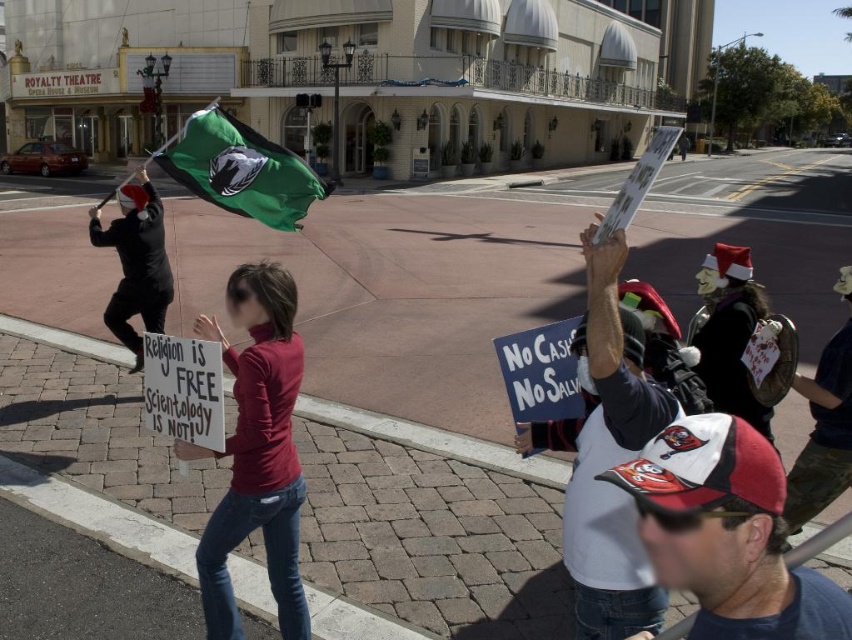
Which is more to the left, green fabric flag at upper left or santa hat at upper right?

Positioned to the left is green fabric flag at upper left.

Locate an element on the screen. green fabric flag at upper left is located at coordinates (240, 170).

Who is taller, white fabric cap at center or green fabric flag at upper left?

With more height is green fabric flag at upper left.

Who is more distant from viewer, (761,449) or (204,177)?

The point (204,177) is behind.

Is point (622, 470) behind point (279, 161)?

No, (622, 470) is in front of (279, 161).

Where is `white fabric cap at center`? Image resolution: width=852 pixels, height=640 pixels. white fabric cap at center is located at coordinates (721, 525).

Which is above, matte red shirt at center or black matte flag at left?

Positioned higher is black matte flag at left.

Does matte red shirt at center have a lesser width compared to black matte flag at left?

Yes, matte red shirt at center is thinner than black matte flag at left.

This screenshot has height=640, width=852. Identify the location of matte red shirt at center. (256, 451).

Locate an element on the screen. matte red shirt at center is located at coordinates (256, 451).